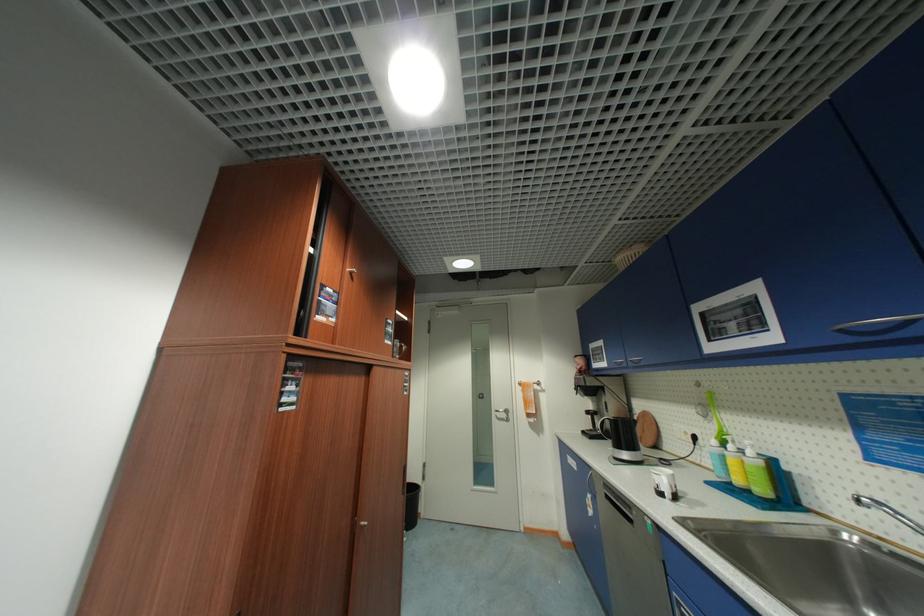
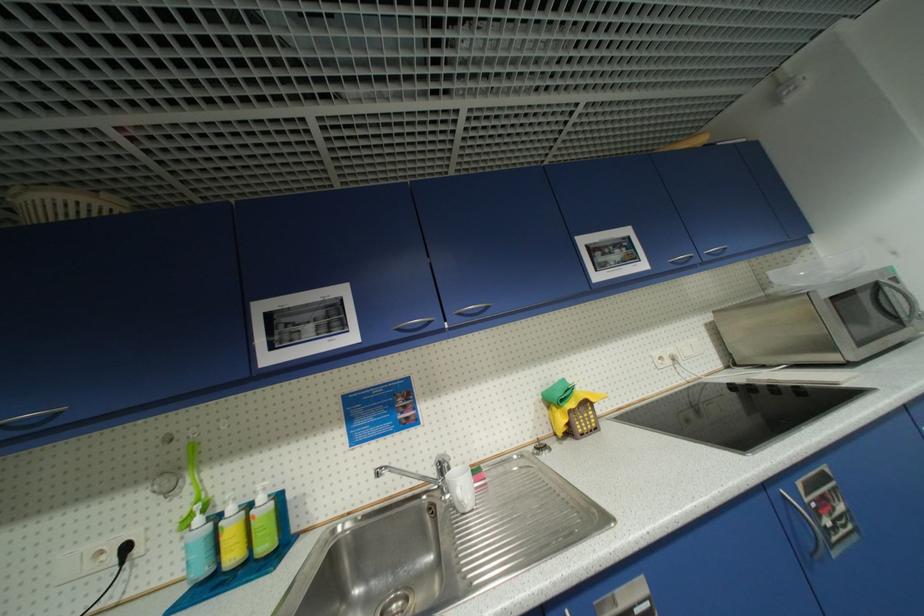
The point at (736, 448) is marked in the first image. Where is the corresponding point in the second image?

(237, 511)